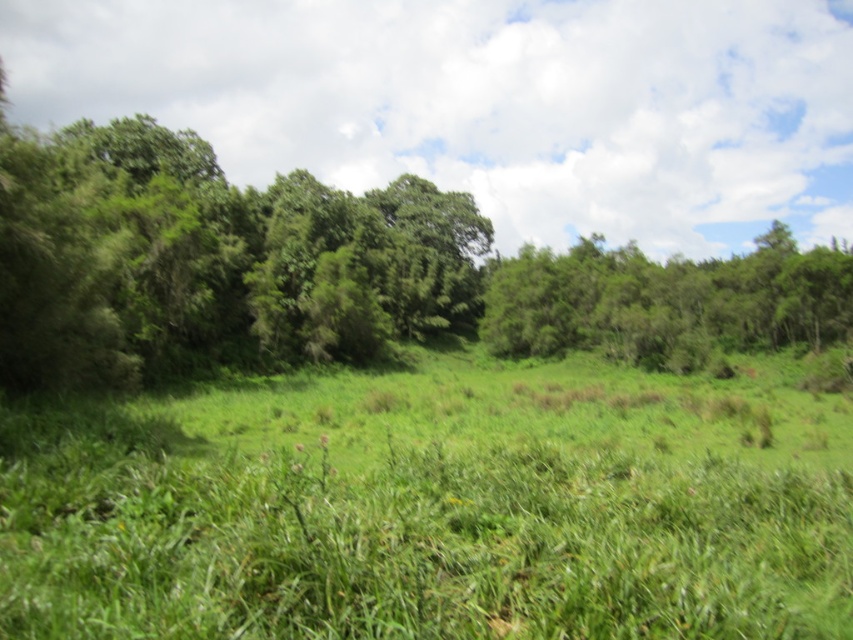
Is green leafy forest at center taller than green leafy tree at center?

In fact, green leafy forest at center may be shorter than green leafy tree at center.

Is point (45, 376) positioned in front of point (610, 257)?

Yes, it is in front of point (610, 257).

Is point (527, 328) closer to viewer compared to point (705, 300)?

No, it is not.

This screenshot has height=640, width=853. What are the coordinates of `green leafy forest at center` in the screenshot? It's located at (332, 272).

Who is taller, green grassy field at center or green leafy forest at center?

green leafy forest at center is taller.

Based on the photo, is green grassy field at center positioned before green leafy forest at center?

Yes.

Between point (242, 589) and point (149, 216), which one is positioned in front?

Point (242, 589) is in front.

This screenshot has width=853, height=640. Identify the location of green grassy field at center. (434, 504).

Which of these two, green grassy field at center or green leafy tree at center, stands shorter?

green grassy field at center is shorter.

In order to click on green grassy field at center in this screenshot , I will do [x=434, y=504].